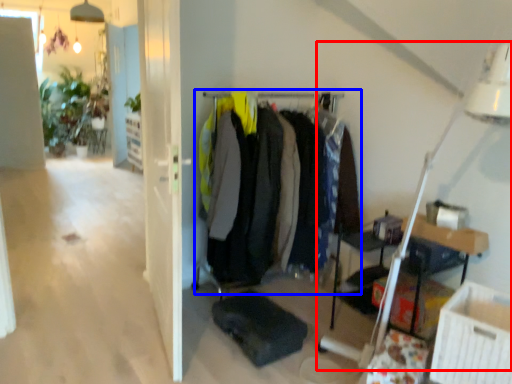
Question: Which object appears closest to the camera in this image, table lamp (highlighted by a red box) or closet (highlighted by a blue box)?

Choices:
 (A) table lamp
 (B) closet

Answer: (A)